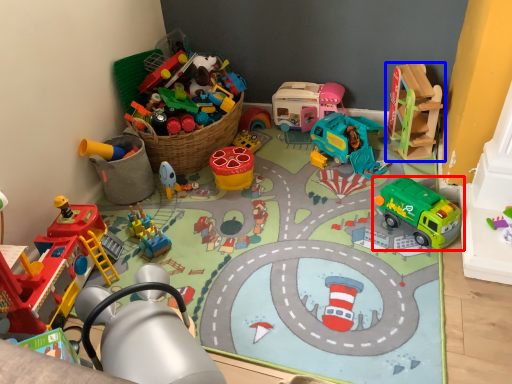
Question: Among these objects, which one is nearest to the camera, toy (highlighted by a red box) or toy (highlighted by a blue box)?

Choices:
 (A) toy
 (B) toy

Answer: (A)